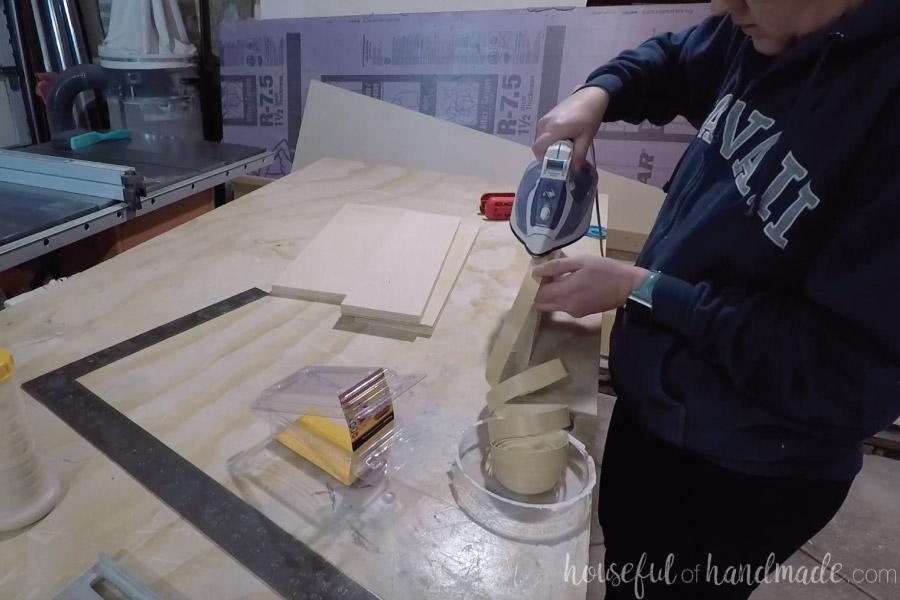
Image resolution: width=900 pixels, height=600 pixels. In order to click on iron in this screenshot , I will do `click(547, 222)`.